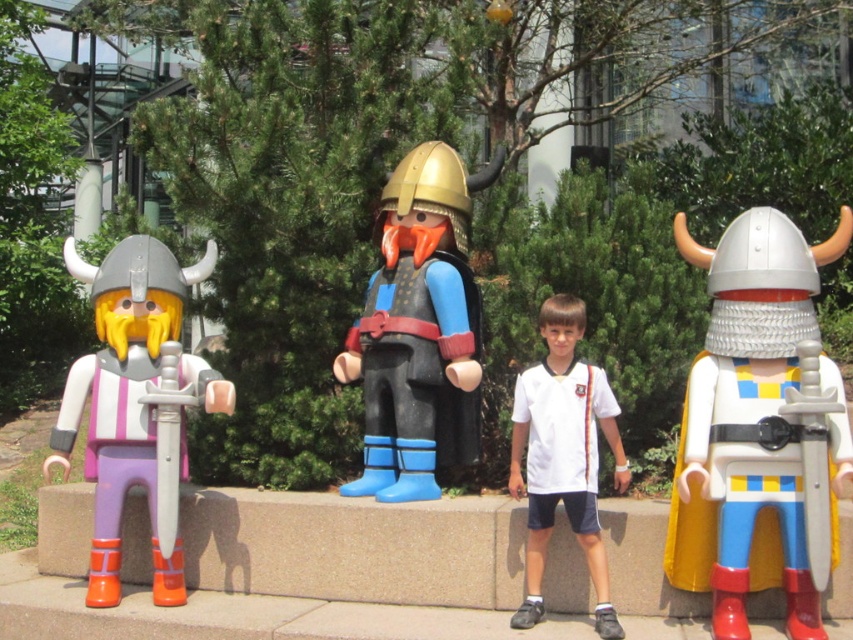
Measure the distance between blue rubber boot at center and camera.

A distance of 4.85 meters exists between blue rubber boot at center and camera.

Between point (448, 360) and point (595, 570), which one is positioned behind?

Positioned behind is point (448, 360).

Does point (463, 349) lie in front of point (585, 410)?

No, (463, 349) is behind (585, 410).

Find the location of a particular element. blue rubber boot at center is located at coordinates (418, 330).

Which is below, matte white helmet at center or blue rubber boot at center?

matte white helmet at center

Is the position of matte white helmet at center less distant than that of blue rubber boot at center?

Yes, it is.

The image size is (853, 640). What do you see at coordinates (764, 413) in the screenshot?
I see `matte white helmet at center` at bounding box center [764, 413].

Identify the location of matte white helmet at center. (764, 413).

Who is more distant from viewer, (733, 634) or (155, 468)?

Point (155, 468)

Between point (708, 332) and point (122, 429), which one is positioned in front?

Point (708, 332) is more forward.

Which is behind, point (715, 308) or point (109, 552)?

Positioned behind is point (109, 552).

At what (x,y) coordinates should I click in order to perform the action: click on matte white helmet at center. Please return your answer as a coordinate pair (x, y). Looking at the image, I should click on (764, 413).